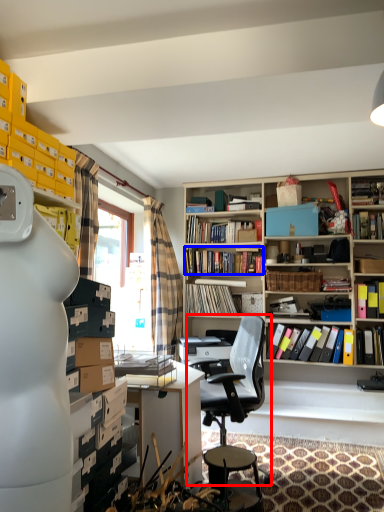
Question: Which point is further to the camera, chair (highlighted by a red box) or book (highlighted by a blue box)?

Choices:
 (A) chair
 (B) book

Answer: (B)